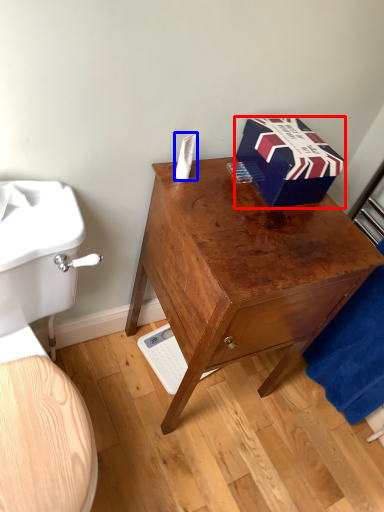
Question: Which object appears closest to the camera in this image, box (highlighted by a red box) or toilet paper (highlighted by a blue box)?

Choices:
 (A) box
 (B) toilet paper

Answer: (A)